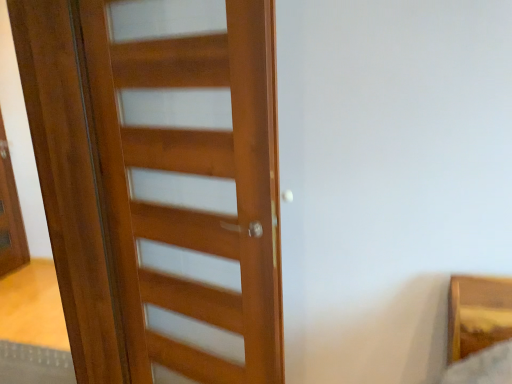
Question: Considering their positions, is matte wooden screen door at left located in front of or behind wooden door at left?

Choices:
 (A) front
 (B) behind

Answer: (B)

Question: Visually, is matte wooden screen door at left positioned to the left or to the right of wooden door at left?

Choices:
 (A) right
 (B) left

Answer: (B)

Question: Which is correct: matte wooden screen door at left is inside wooden door at left, or outside of it?

Choices:
 (A) outside
 (B) inside

Answer: (A)

Question: Relative to matte wooden screen door at left, is wooden door at left in front or behind?

Choices:
 (A) behind
 (B) front

Answer: (B)

Question: Considering the positions of wooden door at left and matte wooden screen door at left in the image, is wooden door at left taller or shorter than matte wooden screen door at left?

Choices:
 (A) short
 (B) tall

Answer: (B)

Question: Is point (101, 14) positioned closer to the camera than point (0, 165)?

Choices:
 (A) farther
 (B) closer

Answer: (B)

Question: Considering the positions of wooden door at left and matte wooden screen door at left in the image, is wooden door at left wider or thinner than matte wooden screen door at left?

Choices:
 (A) wide
 (B) thin

Answer: (A)